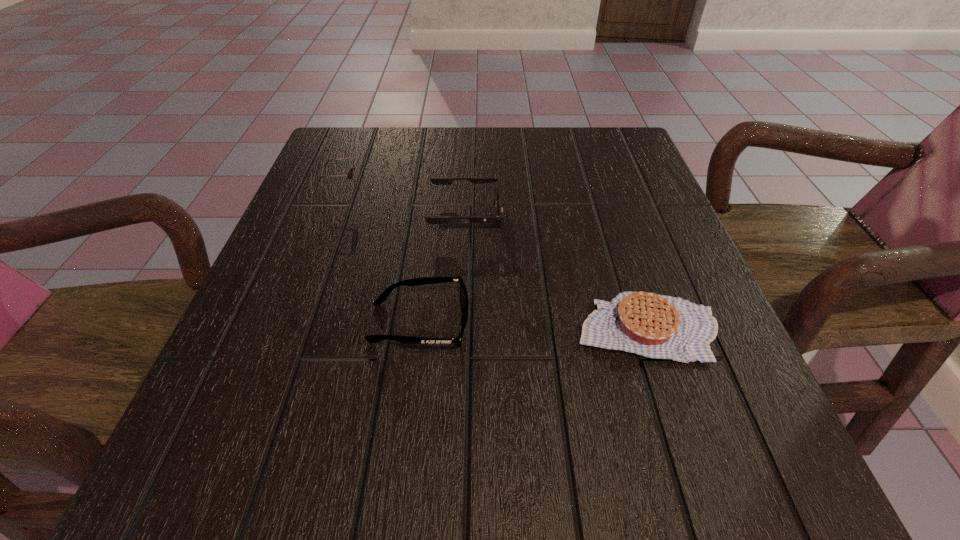
Image resolution: width=960 pixels, height=540 pixels. I want to click on the leftmost sunglasses, so click(349, 174).

Identify the location of the tallest sunglasses. The image size is (960, 540). (349, 174).

You are a GUI agent. You are given a task and a screenshot of the screen. Output one action in this format:
    pyautogui.click(x=<x>, y=<y>)
    Task: Click on the nearest sunglasses
    The width and height of the screenshot is (960, 540).
    Given the screenshot: What is the action you would take?
    pyautogui.click(x=423, y=280)

The width and height of the screenshot is (960, 540). What are the coordinates of `the rightmost object` in the screenshot? It's located at (656, 326).

You are a GUI agent. You are given a task and a screenshot of the screen. Output one action in this format:
    pyautogui.click(x=<x>, y=<y>)
    Task: Click on the shortest object
    
    Given the screenshot: What is the action you would take?
    pyautogui.click(x=656, y=326)

I want to click on vacant space situated 0.080m in front of the lenses of the leftmost sunglasses, so click(396, 191).

Locate an element on the screen. The image size is (960, 540). vacant area situated 0.170m on the front-facing side of the nearest sunglasses is located at coordinates (571, 322).

The height and width of the screenshot is (540, 960). I want to click on vacant space located 0.140m on the front of the pie, so click(x=688, y=456).

Where is `object positioned at the far edge`? object positioned at the far edge is located at coordinates (349, 174).

The width and height of the screenshot is (960, 540). In order to click on object present at the left edge in this screenshot , I will do `click(349, 174)`.